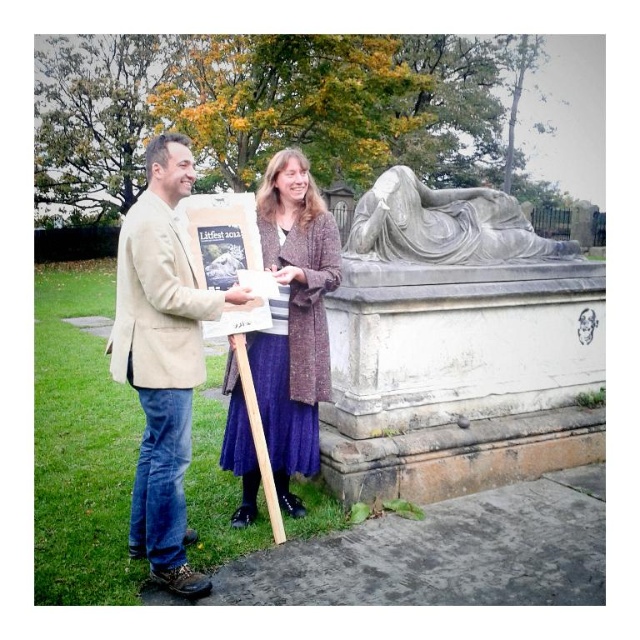
You are a photographer at the Litfest 2013 ceremony. You want to capture a photo where both the beige fabric jacket at center and the white marble statue at right are clearly visible. Based on their positions, will the statue be visible behind the jacket?

The beige fabric jacket at center is in front of the white marble statue at right, so the statue will be partially or fully obscured in the photo. To ensure both are visible, adjust the position so the jacket is not blocking the statue.

You are a photographer at a park event and need to capture both the velvet purple skirt at center and the white marble statue at right in a single shot. Given their sizes, which object should you focus on to ensure both are visible in the frame?

Since the velvet purple skirt at center is smaller than the white marble statue at right, you should focus on the white marble statue at right as it occupies more space, allowing the smaller velvet purple skirt at center to fit into the frame alongside it.